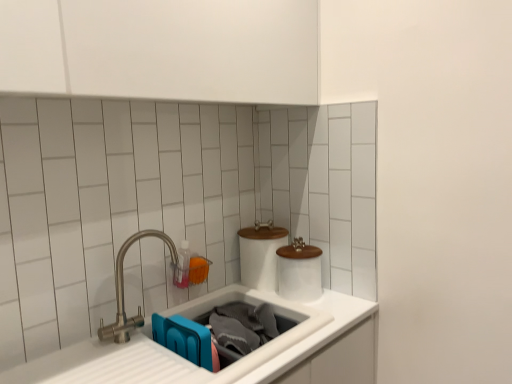
Question: Would you say brushed metal faucet at left is a long distance from white matte sink at lower center, the second sink positioned from the left?

Choices:
 (A) yes
 (B) no

Answer: (B)

Question: Considering the relative sizes of brushed metal faucet at left and white matte sink at lower center, the second sink positioned from the left, in the image provided, is brushed metal faucet at left thinner than white matte sink at lower center, the second sink positioned from the left,?

Choices:
 (A) no
 (B) yes

Answer: (B)

Question: From the image's perspective, is brushed metal faucet at left on white matte sink at lower center, marked as the first sink in a right-to-left arrangement?

Choices:
 (A) yes
 (B) no

Answer: (A)

Question: Does brushed metal faucet at left lie in front of white matte sink at lower center, marked as the first sink in a right-to-left arrangement?

Choices:
 (A) yes
 (B) no

Answer: (A)

Question: From a real-world perspective, is brushed metal faucet at left located higher than white matte sink at lower center, marked as the first sink in a right-to-left arrangement?

Choices:
 (A) no
 (B) yes

Answer: (B)

Question: In the image, is white glossy toilet paper at center, which is the 2th toilet paper in left-to-right order, on the left side or the right side of brushed metal faucet at left?

Choices:
 (A) left
 (B) right

Answer: (B)

Question: Is white glossy toilet paper at center, which is the 2th toilet paper in left-to-right order, bigger or smaller than brushed metal faucet at left?

Choices:
 (A) big
 (B) small

Answer: (A)

Question: Does point (294, 243) appear closer or farther from the camera than point (113, 327)?

Choices:
 (A) closer
 (B) farther

Answer: (B)

Question: In terms of height, does white glossy toilet paper at center, placed as the first toilet paper when sorted from right to left, look taller or shorter compared to brushed metal faucet at left?

Choices:
 (A) tall
 (B) short

Answer: (B)

Question: Is brushed metal faucet at left in front of or behind white matte sink at lower center, marked as the first sink in a right-to-left arrangement, in the image?

Choices:
 (A) front
 (B) behind

Answer: (A)

Question: Considering the positions of brushed metal faucet at left and white matte sink at lower center, the second sink positioned from the left, in the image, is brushed metal faucet at left wider or thinner than white matte sink at lower center, the second sink positioned from the left,?

Choices:
 (A) wide
 (B) thin

Answer: (B)

Question: Is brushed metal faucet at left inside the boundaries of white matte sink at lower center, marked as the first sink in a right-to-left arrangement, or outside?

Choices:
 (A) outside
 (B) inside

Answer: (A)

Question: From the image's perspective, is brushed metal faucet at left positioned above or below white matte sink at lower center, the second sink positioned from the left?

Choices:
 (A) above
 (B) below

Answer: (A)

Question: Considering the positions of point (245, 281) and point (281, 339), is point (245, 281) closer or farther from the camera than point (281, 339)?

Choices:
 (A) farther
 (B) closer

Answer: (A)

Question: In the image, is white ceramic toilet paper at center, which is the first toilet paper in left-to-right order, positioned in front of or behind white matte sink at lower center, the second sink positioned from the left?

Choices:
 (A) behind
 (B) front

Answer: (A)